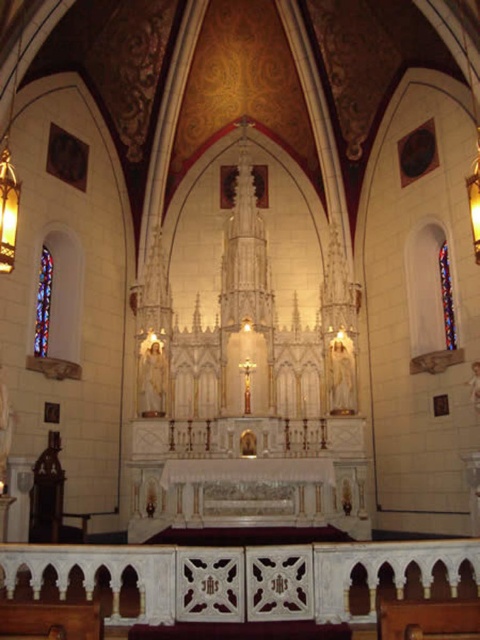
Does stained glass window at left have a smaller size compared to stained glass window at right?

Incorrect, stained glass window at left is not smaller in size than stained glass window at right.

In the scene shown: Can you confirm if stained glass window at left is positioned to the right of stained glass window at right?

No, stained glass window at left is not to the right of stained glass window at right.

Image resolution: width=480 pixels, height=640 pixels. Identify the location of stained glass window at left. (43, 304).